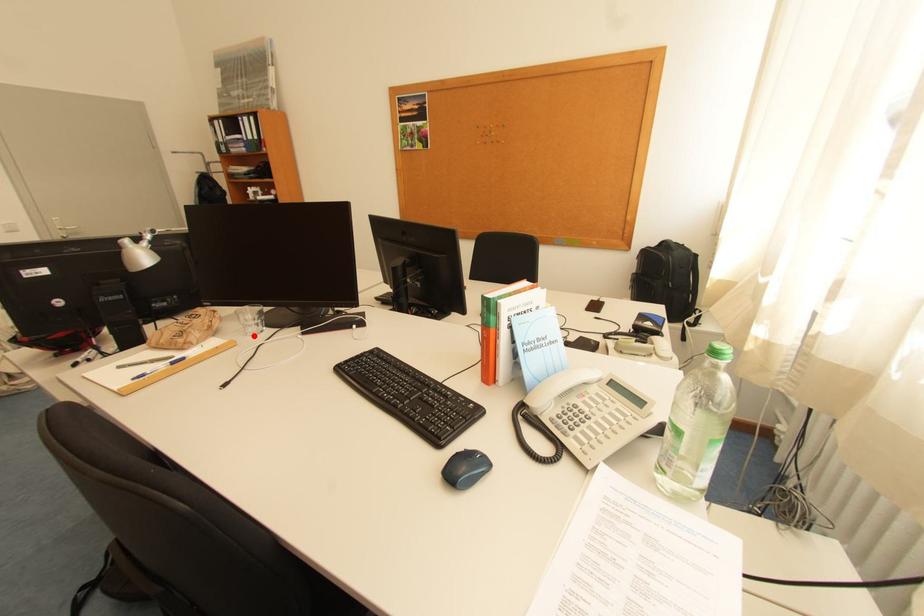
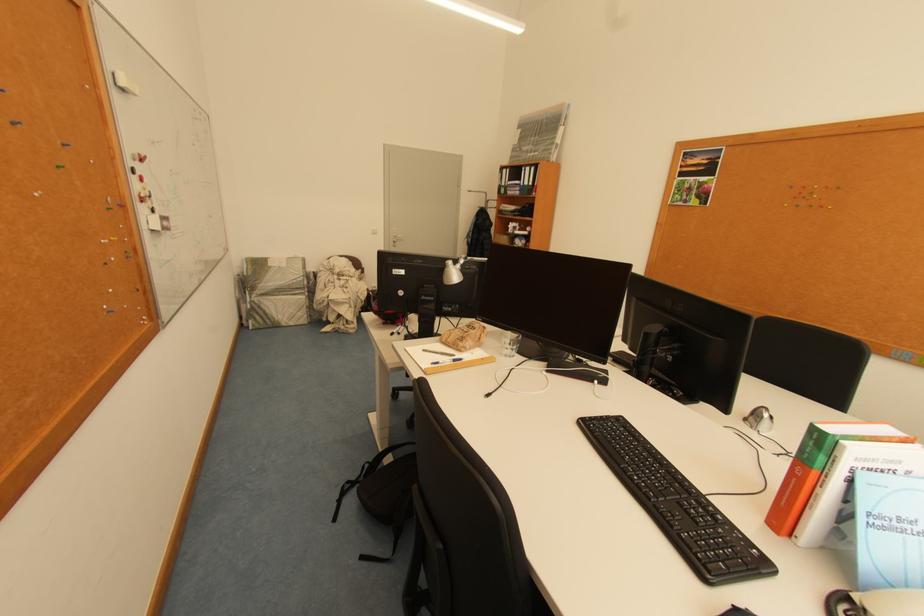
Find the pixel in the second image that matches the highlighted location in the first image.

(508, 355)